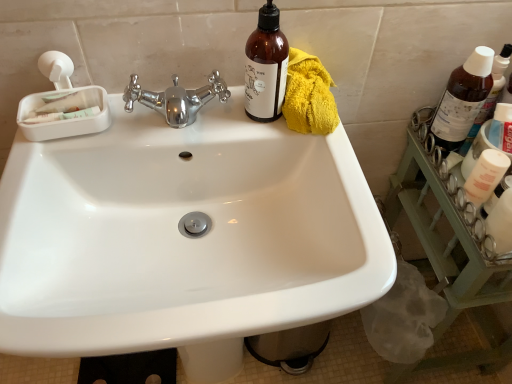
Question: From the image's perspective, is yellow fluffy towel at upper right above white glossy sink at center?

Choices:
 (A) no
 (B) yes

Answer: (B)

Question: From the image's perspective, would you say yellow fluffy towel at upper right is shown under white glossy sink at center?

Choices:
 (A) yes
 (B) no

Answer: (B)

Question: Can you confirm if yellow fluffy towel at upper right is taller than white glossy sink at center?

Choices:
 (A) yes
 (B) no

Answer: (B)

Question: Is yellow fluffy towel at upper right at the right side of white glossy sink at center?

Choices:
 (A) yes
 (B) no

Answer: (A)

Question: Are yellow fluffy towel at upper right and white glossy sink at center far apart?

Choices:
 (A) yes
 (B) no

Answer: (B)

Question: From a real-world perspective, does yellow fluffy towel at upper right stand above white glossy sink at center?

Choices:
 (A) no
 (B) yes

Answer: (B)

Question: Can you see brown glass bottle at upper right, marked as the third bottle in a left-to-right arrangement, touching yellow fluffy towel at upper right?

Choices:
 (A) no
 (B) yes

Answer: (A)

Question: Considering the relative sizes of brown glass bottle at upper right, marked as the third bottle in a left-to-right arrangement, and yellow fluffy towel at upper right in the image provided, is brown glass bottle at upper right, marked as the third bottle in a left-to-right arrangement, bigger than yellow fluffy towel at upper right?

Choices:
 (A) no
 (B) yes

Answer: (A)

Question: Is brown glass bottle at upper right, marked as the third bottle in a left-to-right arrangement, oriented towards yellow fluffy towel at upper right?

Choices:
 (A) no
 (B) yes

Answer: (A)

Question: From a real-world perspective, is brown glass bottle at upper right, marked as the third bottle in a left-to-right arrangement, over yellow fluffy towel at upper right?

Choices:
 (A) yes
 (B) no

Answer: (B)

Question: Would you say brown glass bottle at upper right, marked as the third bottle in a left-to-right arrangement, is outside yellow fluffy towel at upper right?

Choices:
 (A) no
 (B) yes

Answer: (B)

Question: Is brown glass bottle at upper right, placed as the first bottle when sorted from right to left, thinner than yellow fluffy towel at upper right?

Choices:
 (A) yes
 (B) no

Answer: (A)

Question: Does white glossy sink at center turn towards yellow fluffy towel at upper right?

Choices:
 (A) yes
 (B) no

Answer: (B)